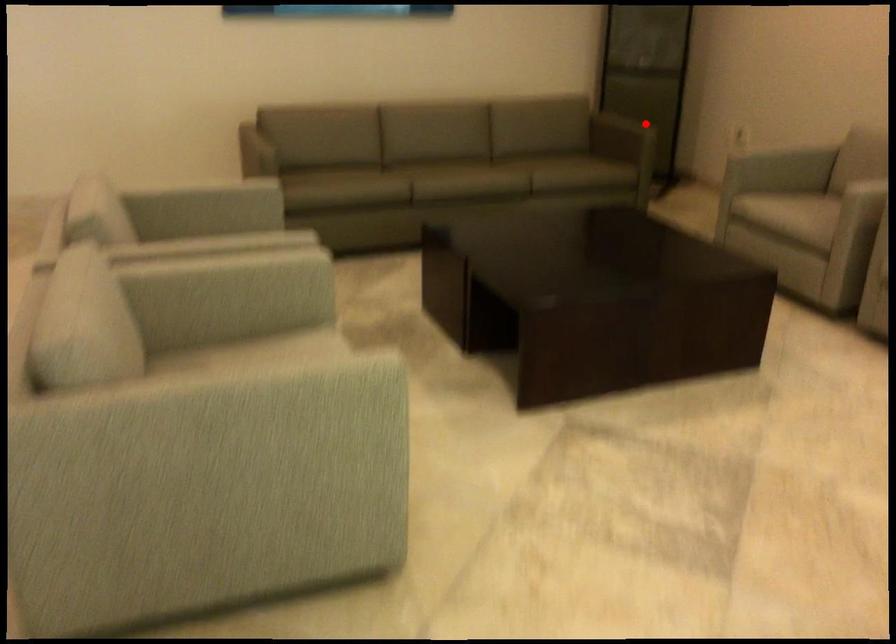
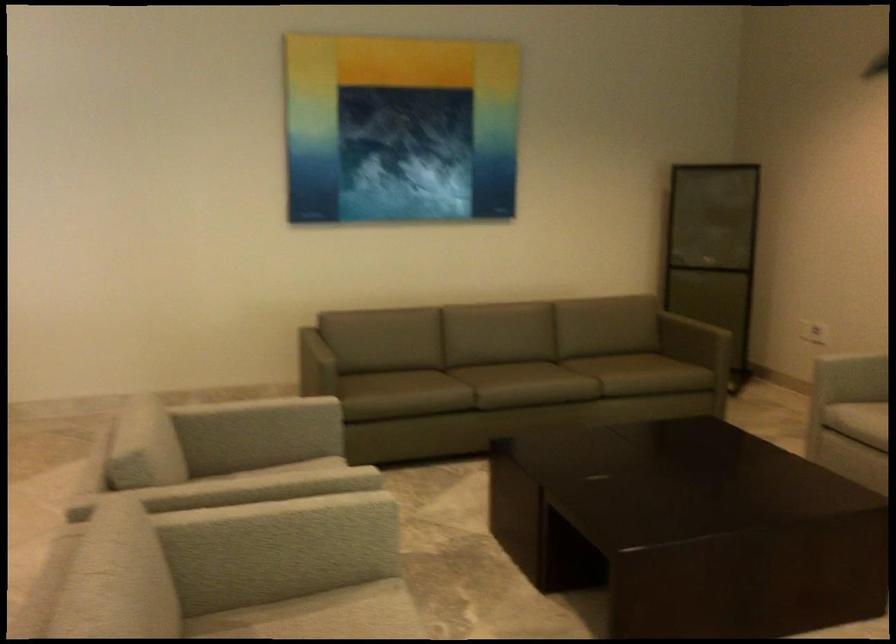
Find the pixel in the second image that matches the highlighted location in the first image.

(713, 317)